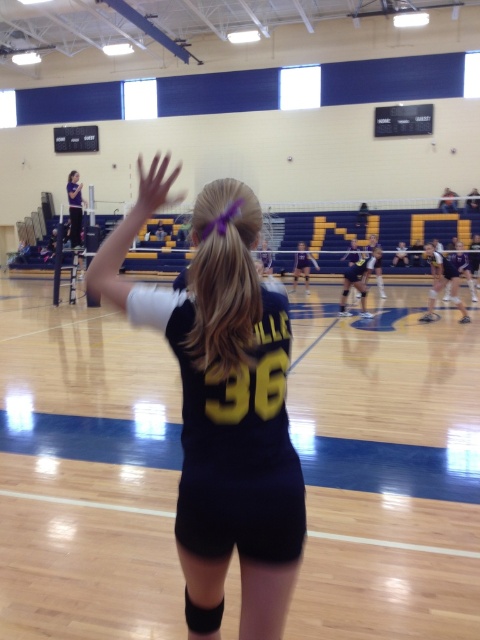
You are a photographer trying to capture the volleyball game. You notice the black jersey at center and the purple jersey at upper left. Which jersey takes up more space in the photo?

The purple jersey at upper left takes up more space in the photo because the black jersey at center occupies less space than purple jersey at upper left.

You are a volleyball coach observing the game. You notice the black fabric volleyball court at center and the purple jersey at upper left. Which object is closer to the front of the image?

The purple jersey at upper left is closer to the front because it is taller than the black fabric volleyball court at center.